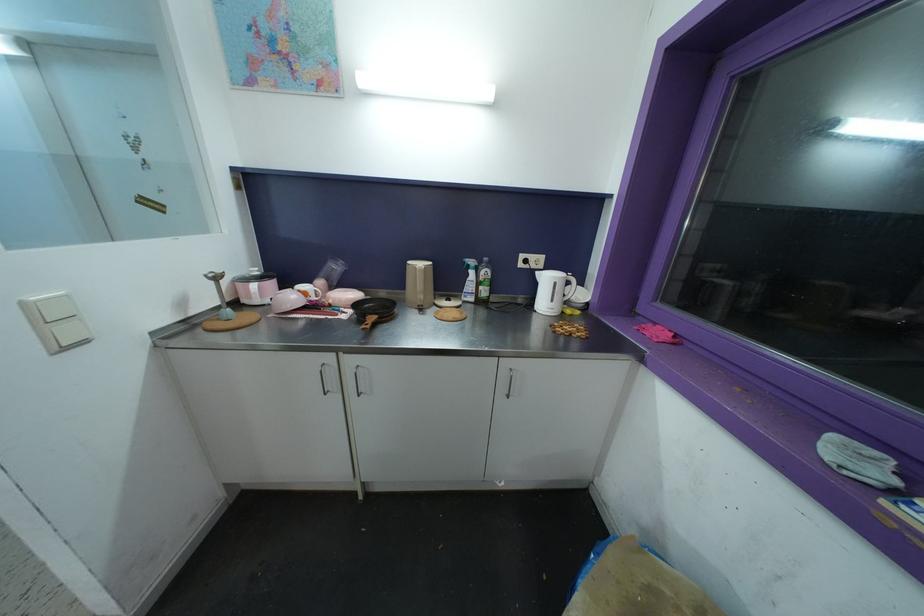
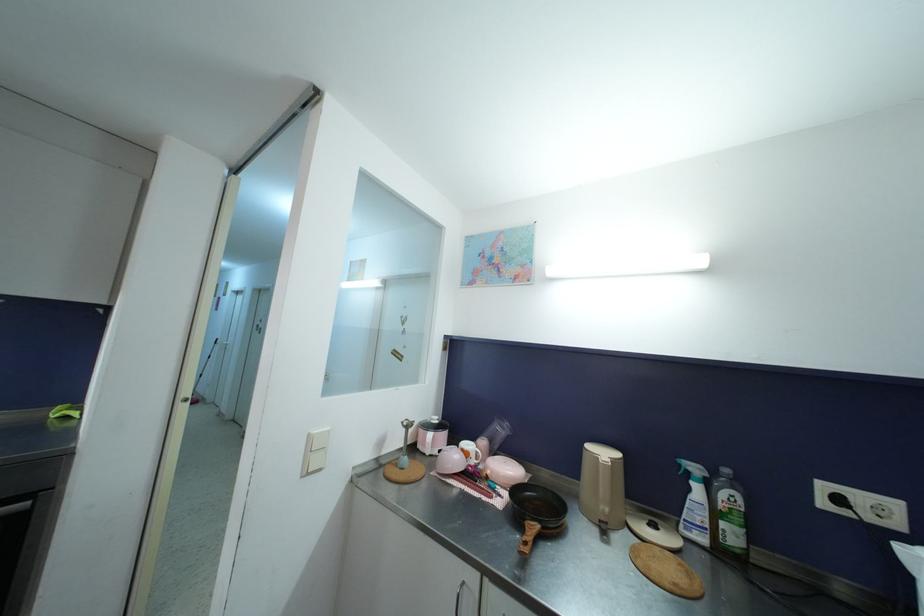
Locate, in the second image, the point that corresponds to point 326,367 in the first image.

(467, 586)